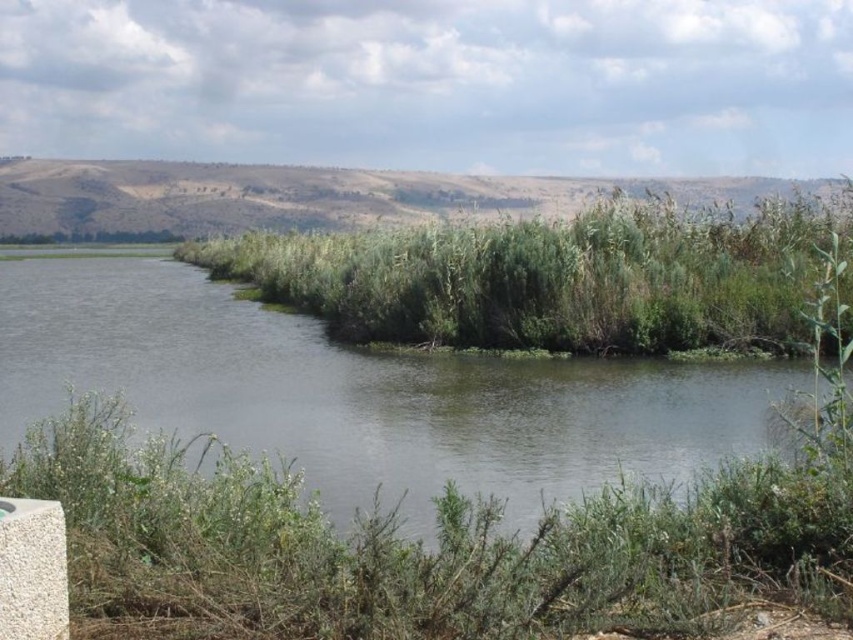
Is green leafy shrubs at lower center to the right of green leafy reeds at center from the viewer's perspective?

Indeed, green leafy shrubs at lower center is positioned on the right side of green leafy reeds at center.

The height and width of the screenshot is (640, 853). What are the coordinates of `green leafy shrubs at lower center` in the screenshot? It's located at (421, 547).

What do you see at coordinates (421, 547) in the screenshot? I see `green leafy shrubs at lower center` at bounding box center [421, 547].

Identify the location of green leafy shrubs at lower center. The width and height of the screenshot is (853, 640). (421, 547).

This screenshot has height=640, width=853. Describe the element at coordinates (421, 547) in the screenshot. I see `green leafy shrubs at lower center` at that location.

Can you confirm if green leafy shrubs at lower center is taller than green grassy river at center?

No.

Locate an element on the screen. The image size is (853, 640). green leafy shrubs at lower center is located at coordinates (421, 547).

Locate an element on the screen. The width and height of the screenshot is (853, 640). green leafy shrubs at lower center is located at coordinates (421, 547).

Can you confirm if green grassy river at center is positioned above green leafy reeds at center?

No, green grassy river at center is not above green leafy reeds at center.

Is the position of green grassy river at center more distant than that of green leafy reeds at center?

No, green grassy river at center is closer to the viewer.

Does point (94, 365) lie behind point (318, 314)?

No, it is not.

Image resolution: width=853 pixels, height=640 pixels. In order to click on green grassy river at center in this screenshot , I will do `click(361, 392)`.